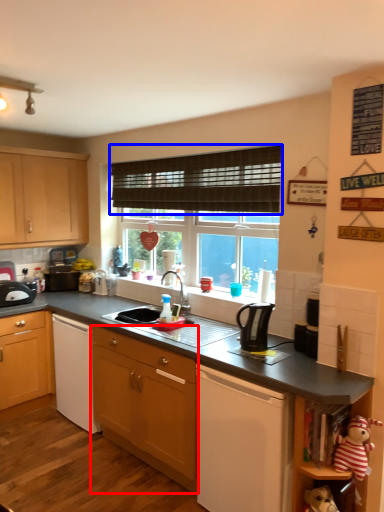
Question: Which object is closer to the camera taking this photo, cabinetry (highlighted by a red box) or blind (highlighted by a blue box)?

Choices:
 (A) cabinetry
 (B) blind

Answer: (A)